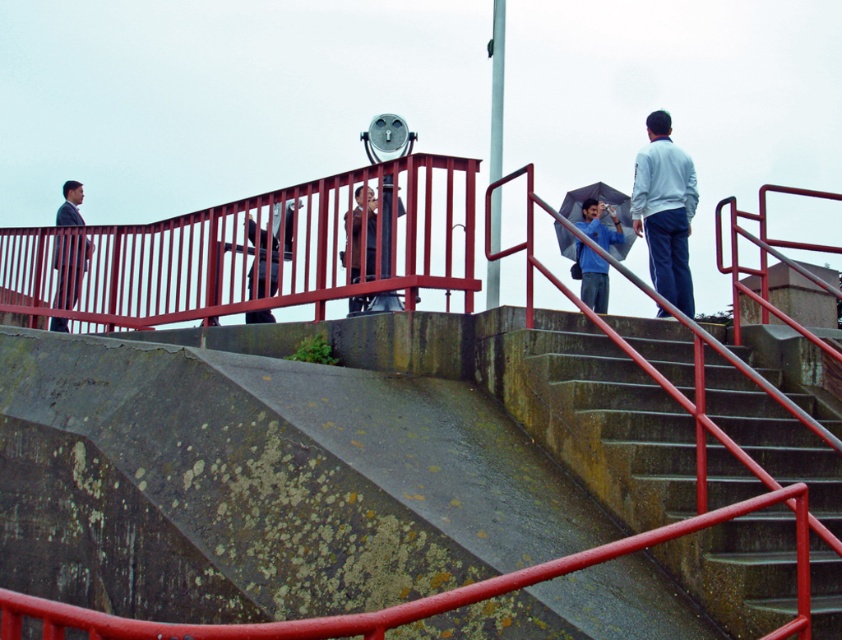
Question: Can you confirm if light blue fabric jacket at upper right is positioned to the right of matte black suit at left?

Choices:
 (A) yes
 (B) no

Answer: (A)

Question: Considering the relative positions of blue fabric umbrella at upper right and transparent plastic umbrella at upper right in the image provided, where is blue fabric umbrella at upper right located with respect to transparent plastic umbrella at upper right?

Choices:
 (A) below
 (B) above

Answer: (A)

Question: Is the position of matte black jacket at center less distant than that of matte black suit at left?

Choices:
 (A) no
 (B) yes

Answer: (B)

Question: Which object is positioned farthest from the matte black jacket at center?

Choices:
 (A) concrete stairs at center
 (B) matte black suit at left

Answer: (B)

Question: Which point is farther to the camera?

Choices:
 (A) (669, 257)
 (B) (77, 268)
 (C) (390, 294)
 (D) (581, 284)

Answer: (D)

Question: Considering the real-world distances, which object is closest to the dark brown leather jacket at center?

Choices:
 (A) transparent plastic umbrella at upper right
 (B) matte black jacket at center
 (C) concrete stairs at center
 (D) light blue fabric jacket at upper right

Answer: (B)